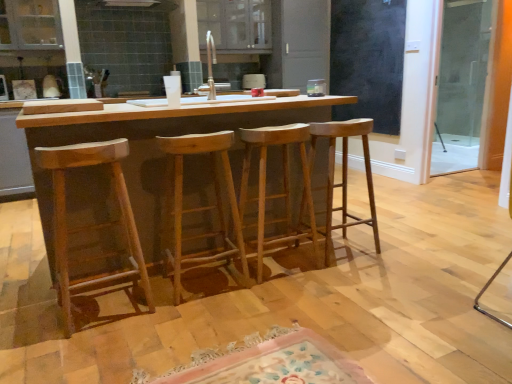
Identify the location of free spot below natural wood stool at left, the 4th stool when ordered from right to left (from a real-world perspective). Image resolution: width=512 pixels, height=384 pixels. (106, 309).